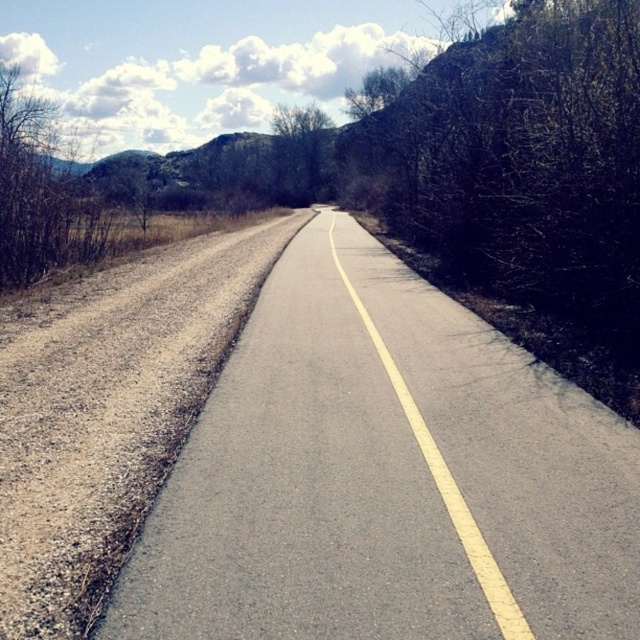
Question: From the image, what is the correct spatial relationship of asphalt road at center in relation to green leafy tree at center?

Choices:
 (A) below
 (B) above

Answer: (A)

Question: Can you confirm if asphalt road at center is positioned above green leafy tree at center?

Choices:
 (A) yes
 (B) no

Answer: (B)

Question: Which point appears farthest from the camera in this image?

Choices:
 (A) (280, 132)
 (B) (483, 369)

Answer: (A)

Question: Among these objects, which one is farthest from the camera?

Choices:
 (A) green leafy tree at center
 (B) asphalt road at center

Answer: (A)

Question: Among these points, which one is nearest to the camera?

Choices:
 (A) (275, 168)
 (B) (422, 278)

Answer: (B)

Question: Does asphalt road at center appear on the right side of green leafy tree at center?

Choices:
 (A) no
 (B) yes

Answer: (B)